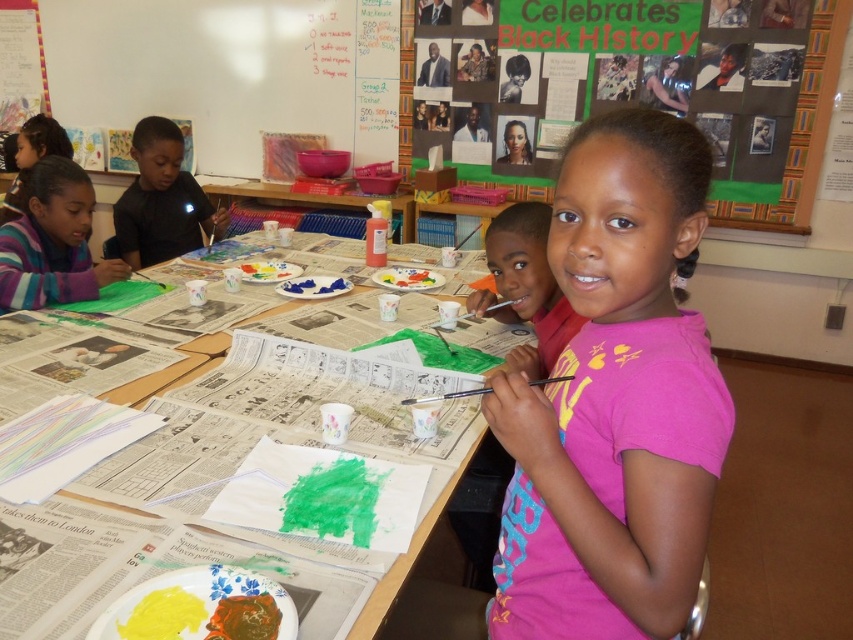
Is green matte bulletin board at upper center to the right of plastic blue tray at center from the viewer's perspective?

Yes, green matte bulletin board at upper center is to the right of plastic blue tray at center.

Who is more forward, (816, 38) or (271, 202)?

Positioned in front is point (816, 38).

Where is `green matte bulletin board at upper center`? Image resolution: width=853 pixels, height=640 pixels. green matte bulletin board at upper center is located at coordinates (799, 132).

Looking at this image, who is positioned more to the left, pink cotton shirt at center or newspaper-covered table at center?

From the viewer's perspective, newspaper-covered table at center appears more on the left side.

Which is behind, point (601, 499) or point (329, 552)?

The point (329, 552) is behind.

Locate an element on the screen. This screenshot has width=853, height=640. pink cotton shirt at center is located at coordinates (614, 401).

Which is more to the left, newspaper-covered table at center or pink matte shirt at center?

From the viewer's perspective, newspaper-covered table at center appears more on the left side.

Can you confirm if newspaper-covered table at center is positioned to the left of pink matte shirt at center?

Indeed, newspaper-covered table at center is positioned on the left side of pink matte shirt at center.

Who is more distant from viewer, (45, 326) or (524, 209)?

Positioned behind is point (45, 326).

What are the coordinates of `newspaper-covered table at center` in the screenshot? It's located at (224, 488).